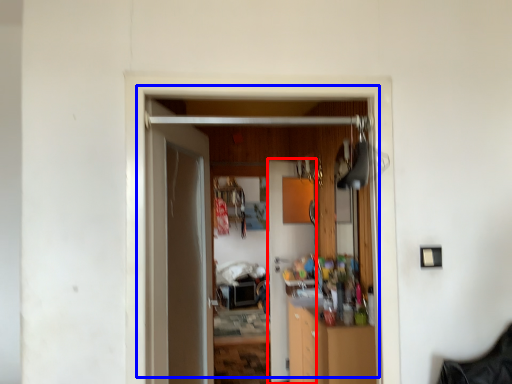
Question: Among these objects, which one is farthest to the camera, door (highlighted by a red box) or door (highlighted by a blue box)?

Choices:
 (A) door
 (B) door

Answer: (A)